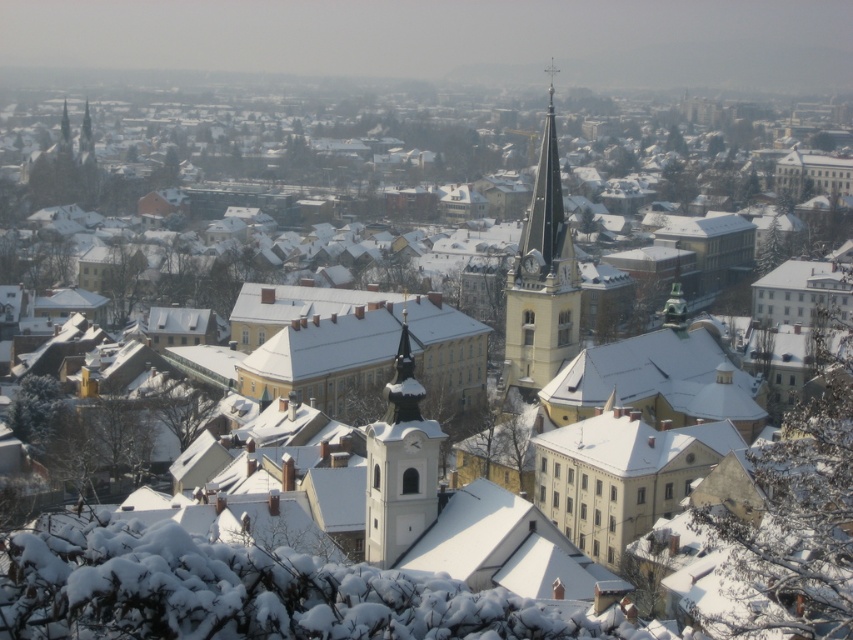
Question: Is smooth white steeple at center below white stone clock tower at center?

Choices:
 (A) yes
 (B) no

Answer: (B)

Question: Does smooth white steeple at center have a larger size compared to white stone clock tower at center?

Choices:
 (A) yes
 (B) no

Answer: (A)

Question: Which of the following is the closest to the observer?

Choices:
 (A) smooth white steeple at center
 (B) white stone clock tower at center

Answer: (B)

Question: Which point is farther to the camera?

Choices:
 (A) coord(567,282)
 (B) coord(401,508)

Answer: (A)

Question: Is smooth white steeple at center below white stone clock tower at center?

Choices:
 (A) yes
 (B) no

Answer: (B)